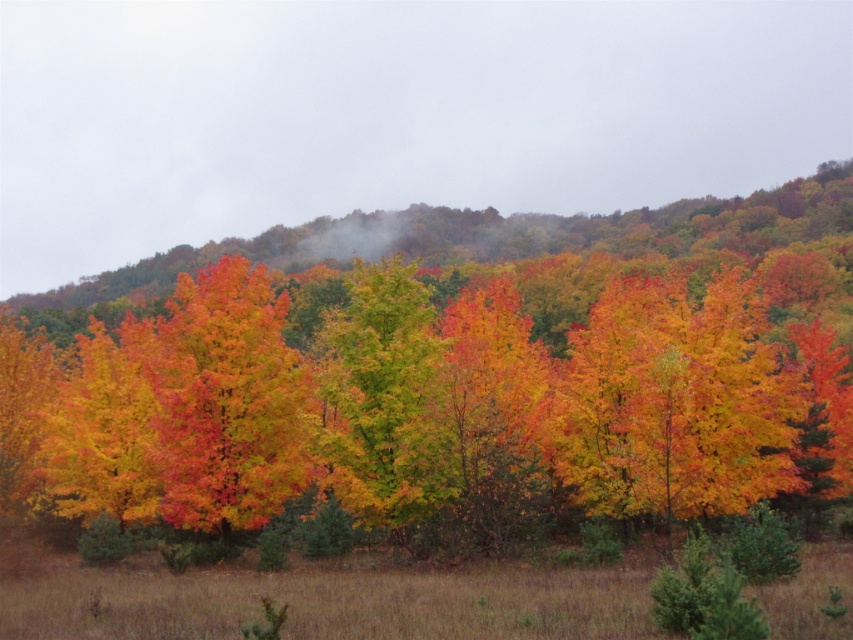
Can you confirm if vivid orange leaves at center is taller than green matte tree at center?

Indeed, vivid orange leaves at center has a greater height compared to green matte tree at center.

The height and width of the screenshot is (640, 853). What do you see at coordinates (463, 384) in the screenshot?
I see `vivid orange leaves at center` at bounding box center [463, 384].

Measure the distance between vivid orange leaves at center and camera.

vivid orange leaves at center is 94.32 feet away from camera.

You are a GUI agent. You are given a task and a screenshot of the screen. Output one action in this format:
    pyautogui.click(x=<x>, y=<y>)
    Task: Click on the vivid orange leaves at center
    The image size is (853, 640).
    Given the screenshot: What is the action you would take?
    pyautogui.click(x=463, y=384)

Is vivid orange leaves at center below shiny orange leaves at center?

No, vivid orange leaves at center is not below shiny orange leaves at center.

Identify the location of vivid orange leaves at center. The height and width of the screenshot is (640, 853). (463, 384).

Consider the image. Who is more distant from viewer, (277, 387) or (325, 448)?

The point (277, 387) is more distant.

Can you confirm if shiny orange leaves at center is positioned to the left of green matte tree at center?

Correct, you'll find shiny orange leaves at center to the left of green matte tree at center.

Which is in front, point (231, 369) or point (344, 467)?

Point (344, 467)

You are a GUI agent. You are given a task and a screenshot of the screen. Output one action in this format:
    pyautogui.click(x=<x>, y=<y>)
    Task: Click on the shiny orange leaves at center
    The image size is (853, 640).
    Given the screenshot: What is the action you would take?
    228,401